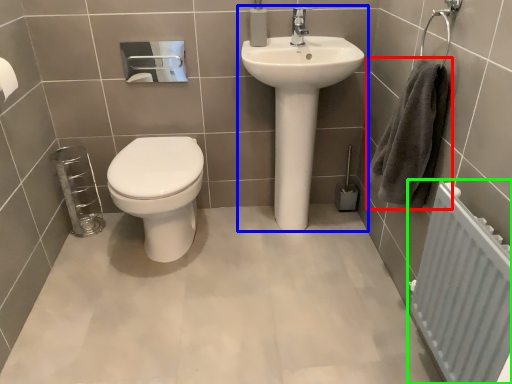
Question: Which is nearer to the hand towel (highlighted by a red box)? sink (highlighted by a blue box) or radiator (highlighted by a green box).

Choices:
 (A) sink
 (B) radiator

Answer: (B)